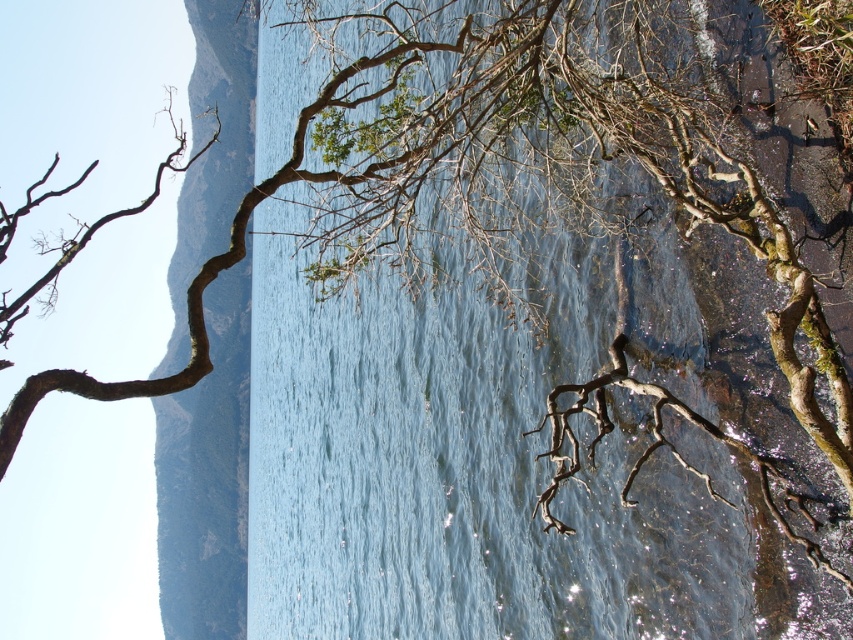
Question: Which point is farther to the camera?

Choices:
 (A) (628, 38)
 (B) (209, 612)

Answer: (B)

Question: Which point is farther from the camera taking this photo?

Choices:
 (A) (209, 456)
 (B) (332, 552)

Answer: (A)

Question: Can you confirm if clear water at center is bigger than brown rough cliff at left?

Choices:
 (A) yes
 (B) no

Answer: (B)

Question: Does clear water at center appear over brown rough cliff at left?

Choices:
 (A) no
 (B) yes

Answer: (B)

Question: Among these objects, which one is farthest from the camera?

Choices:
 (A) brown rough cliff at left
 (B) clear water at center

Answer: (A)

Question: Can you confirm if clear water at center is positioned above brown rough cliff at left?

Choices:
 (A) yes
 (B) no

Answer: (A)